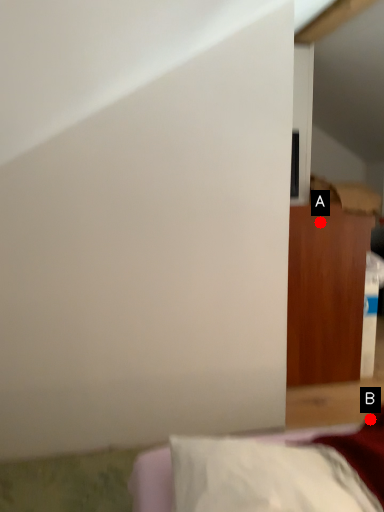
Question: Two points are circled on the image, labeled by A and B beside each circle. Which point is closer to the camera taking this photo?

Choices:
 (A) A is closer
 (B) B is closer

Answer: (B)